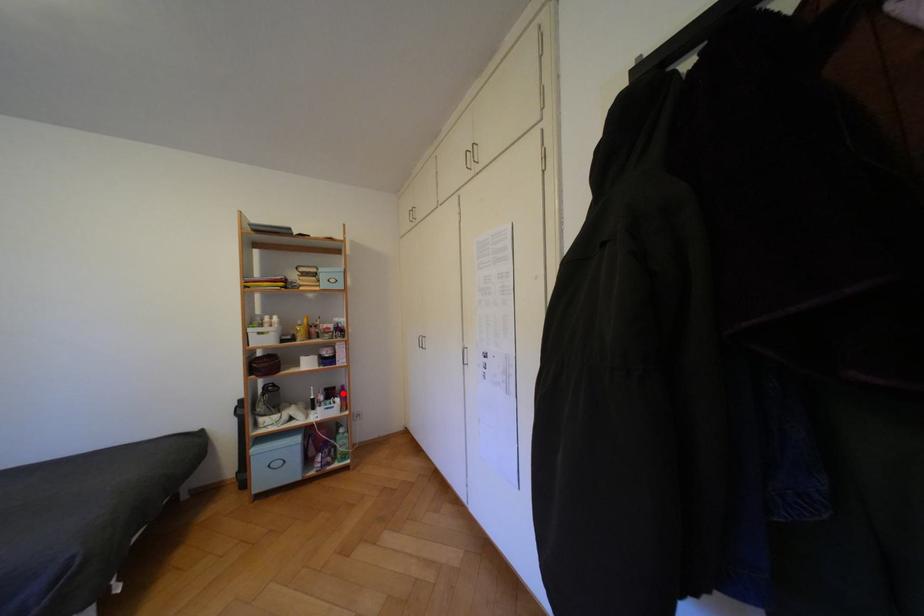
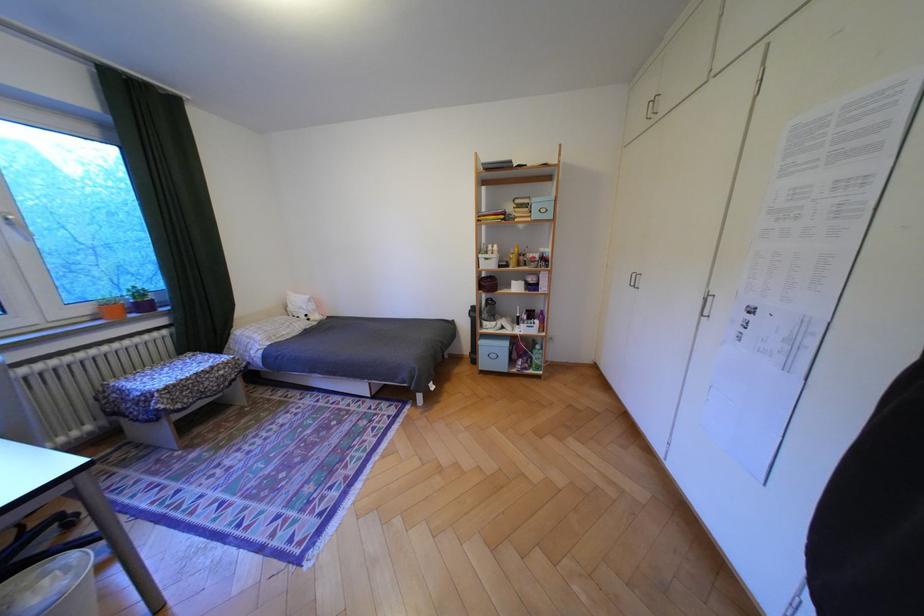
Locate, in the second image, the point that corresponds to the highlighted location in the first image.

(542, 315)